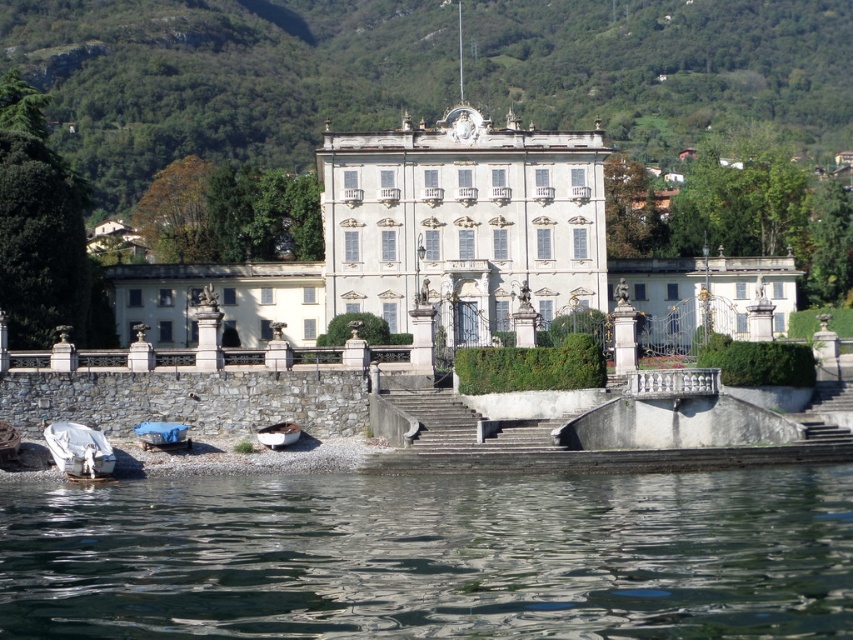
Question: Is gray concrete stairs at lower center to the left of blue fabric boat at lower left from the viewer's perspective?

Choices:
 (A) yes
 (B) no

Answer: (B)

Question: Does gray concrete stairs at lower center have a smaller size compared to white matte boat at lower left?

Choices:
 (A) no
 (B) yes

Answer: (A)

Question: Which object is closer to the camera taking this photo?

Choices:
 (A) white fabric boat at lower left
 (B) blue fabric boat at lower left
 (C) white matte boat at lower left
 (D) gray concrete stairs at center

Answer: (D)

Question: Is the position of clear water at lower center less distant than that of white fabric boat at lower left?

Choices:
 (A) no
 (B) yes

Answer: (B)

Question: Which point is farther to the camera?

Choices:
 (A) clear water at lower center
 (B) blue fabric boat at lower left
 (C) gray concrete stairs at center
 (D) gray concrete stairs at lower center

Answer: (B)

Question: Estimate the real-world distances between objects in this image. Which object is closer to the white fabric boat at lower left?

Choices:
 (A) clear water at lower center
 (B) gray concrete stairs at center
 (C) blue fabric boat at lower left
 (D) white matte boat at lower left

Answer: (C)